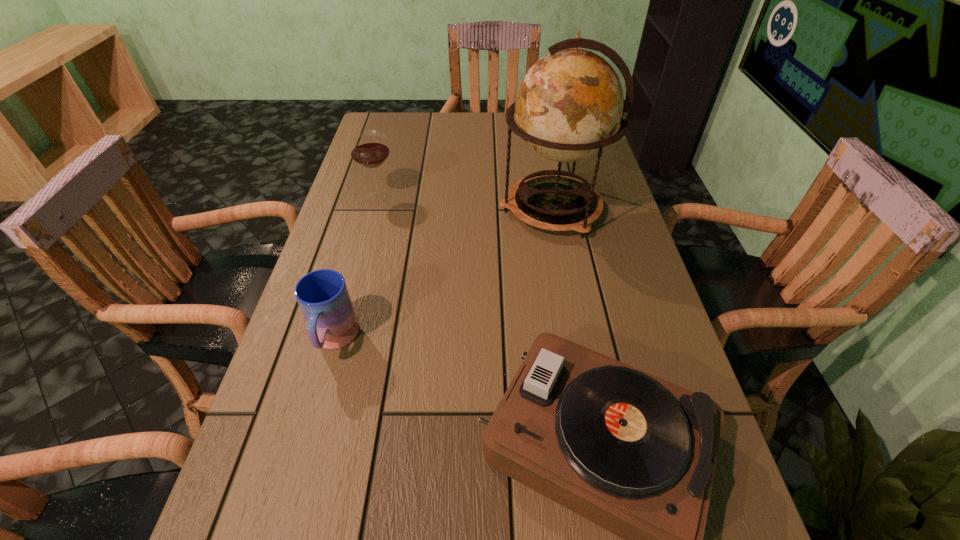
Identify the location of object that is at the right edge. Image resolution: width=960 pixels, height=540 pixels. (568, 106).

You are a GUI agent. You are given a task and a screenshot of the screen. Output one action in this format:
    pyautogui.click(x=<x>, y=<y>)
    Task: Click on the free space at the far edge
    This screenshot has width=960, height=540.
    Given the screenshot: What is the action you would take?
    pyautogui.click(x=492, y=136)

In the image, there is a desktop. Where is `vacant space at the left edge`? This screenshot has height=540, width=960. vacant space at the left edge is located at coordinates (310, 397).

You are a GUI agent. You are given a task and a screenshot of the screen. Output one action in this format:
    pyautogui.click(x=<x>, y=<y>)
    Task: Click on the vacant area at the right edge of the desktop
    The image size is (960, 540).
    Given the screenshot: What is the action you would take?
    pyautogui.click(x=607, y=206)

Where is `blank region between the mug and the wineglass`? The height and width of the screenshot is (540, 960). blank region between the mug and the wineglass is located at coordinates (356, 269).

At what (x,y) coordinates should I click in order to perform the action: click on vacant region between the tallest object and the wineglass. Please return your answer as a coordinate pair (x, y). Looking at the image, I should click on (466, 203).

Locate an element on the screen. This screenshot has width=960, height=540. object that ranks as the third closest to the record player is located at coordinates (369, 149).

Where is `object that is the third closest one to the globe`? This screenshot has width=960, height=540. object that is the third closest one to the globe is located at coordinates (322, 295).

Locate an element on the screen. The width and height of the screenshot is (960, 540). free space that satisfies the following two spatial constraints: 1. at the center of the tallest object; 2. on the side of the mug with the handle is located at coordinates (576, 341).